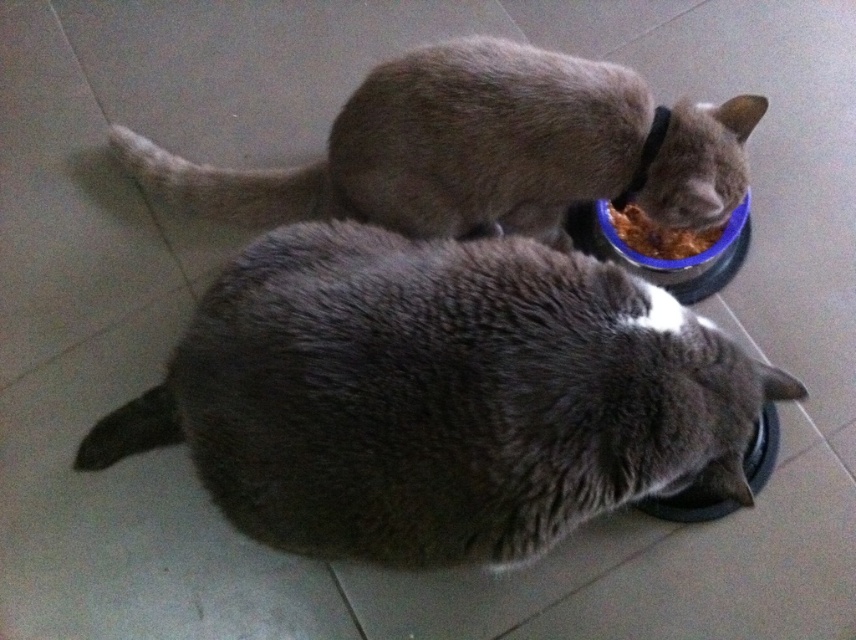
Does gray fluffy cat at lower center appear on the right side of fuzzy gray cat at upper center?

Incorrect, gray fluffy cat at lower center is not on the right side of fuzzy gray cat at upper center.

Which is below, gray fluffy cat at lower center or fuzzy gray cat at upper center?

gray fluffy cat at lower center is below.

At what (x,y) coordinates should I click in order to perform the action: click on gray fluffy cat at lower center. Please return your answer as a coordinate pair (x, y). The width and height of the screenshot is (856, 640). Looking at the image, I should click on (438, 396).

Locate an element on the screen. Image resolution: width=856 pixels, height=640 pixels. gray fluffy cat at lower center is located at coordinates (438, 396).

Can you confirm if fuzzy gray cat at upper center is bigger than brown matte food at center?

Indeed, fuzzy gray cat at upper center has a larger size compared to brown matte food at center.

Between point (465, 68) and point (652, 240), which one is positioned behind?

The point (652, 240) is behind.

Measure the distance between point (385, 216) and camera.

The distance of point (385, 216) from camera is 4.22 feet.

Where is `fuzzy gray cat at upper center`? fuzzy gray cat at upper center is located at coordinates (484, 148).

Who is more distant from viewer, (727, 240) or (675, 248)?

Positioned behind is point (675, 248).

Image resolution: width=856 pixels, height=640 pixels. Find the location of `blue plastic bowl at center`. blue plastic bowl at center is located at coordinates (663, 259).

Locate an element on the screen. blue plastic bowl at center is located at coordinates pyautogui.click(x=663, y=259).